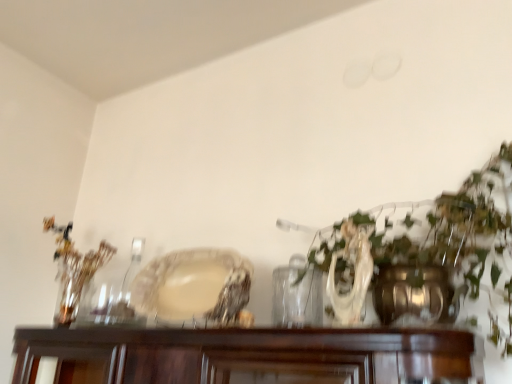
Question: Should I look upward or downward to see matte glass plate at center?

Choices:
 (A) up
 (B) down

Answer: (B)